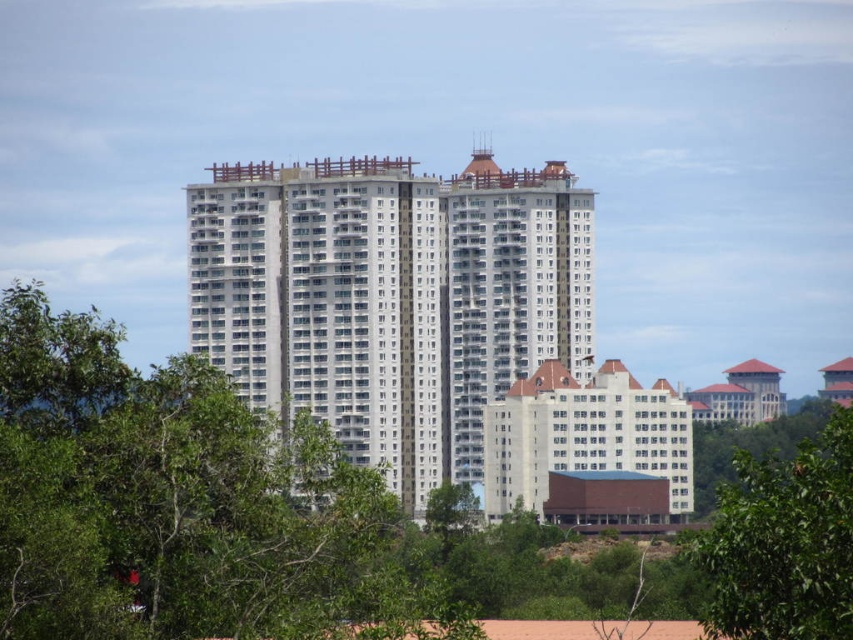
Who is shorter, white concrete building at center or green leafy tree at lower right?

With less height is green leafy tree at lower right.

Describe the element at coordinates (390, 298) in the screenshot. The image size is (853, 640). I see `white concrete building at center` at that location.

The image size is (853, 640). Identify the location of white concrete building at center. (390, 298).

I want to click on white concrete building at center, so click(390, 298).

Image resolution: width=853 pixels, height=640 pixels. What do you see at coordinates (183, 506) in the screenshot?
I see `green leafy tree at center` at bounding box center [183, 506].

Can you confirm if green leafy tree at center is taller than white concrete building at center?

A: In fact, green leafy tree at center may be shorter than white concrete building at center.

What do you see at coordinates (183, 506) in the screenshot?
I see `green leafy tree at center` at bounding box center [183, 506].

Locate an element on the screen. Image resolution: width=853 pixels, height=640 pixels. green leafy tree at center is located at coordinates (183, 506).

Based on the photo, is green leafy tree at center taller than green leafy tree at lower right?

Yes, green leafy tree at center is taller than green leafy tree at lower right.

The height and width of the screenshot is (640, 853). What do you see at coordinates (183, 506) in the screenshot?
I see `green leafy tree at center` at bounding box center [183, 506].

What do you see at coordinates (183, 506) in the screenshot? The image size is (853, 640). I see `green leafy tree at center` at bounding box center [183, 506].

Identify the location of green leafy tree at center. (183, 506).